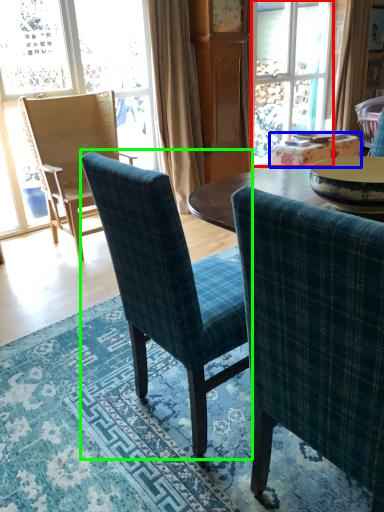
Question: Estimate the real-world distances between objects in this image. Which object is closer to glass door (highlighted by a red box), table (highlighted by a blue box) or chair (highlighted by a green box)?

Choices:
 (A) table
 (B) chair

Answer: (A)